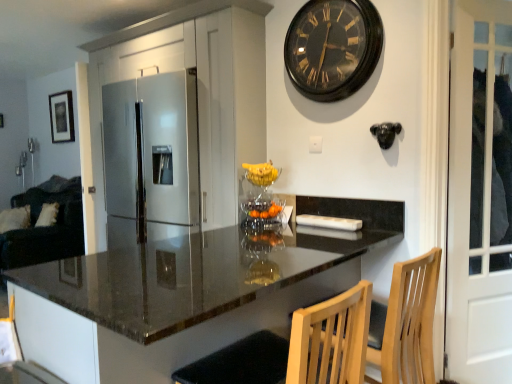
Question: From the image's perspective, is black wooden clock at upper center over black matte picture frame at upper left?

Choices:
 (A) no
 (B) yes

Answer: (A)

Question: Is black matte picture frame at upper left completely or partially inside black wooden clock at upper center?

Choices:
 (A) no
 (B) yes

Answer: (A)

Question: Does black wooden clock at upper center have a greater width compared to black matte picture frame at upper left?

Choices:
 (A) yes
 (B) no

Answer: (A)

Question: Can you confirm if black wooden clock at upper center is shorter than black matte picture frame at upper left?

Choices:
 (A) no
 (B) yes

Answer: (B)

Question: Can you confirm if black wooden clock at upper center is bigger than black matte picture frame at upper left?

Choices:
 (A) no
 (B) yes

Answer: (B)

Question: Does black wooden clock at upper center appear on the right side of black matte picture frame at upper left?

Choices:
 (A) yes
 (B) no

Answer: (A)

Question: Can you confirm if white glass door at right is thinner than polished granite countertop at center?

Choices:
 (A) no
 (B) yes

Answer: (B)

Question: Is white glass door at right to the left of polished granite countertop at center from the viewer's perspective?

Choices:
 (A) yes
 (B) no

Answer: (B)

Question: Is white glass door at right looking in the opposite direction of polished granite countertop at center?

Choices:
 (A) no
 (B) yes

Answer: (A)

Question: Is white glass door at right taller than polished granite countertop at center?

Choices:
 (A) yes
 (B) no

Answer: (A)

Question: From a real-world perspective, is white glass door at right on polished granite countertop at center?

Choices:
 (A) yes
 (B) no

Answer: (A)

Question: Would you say white glass door at right is a long distance from polished granite countertop at center?

Choices:
 (A) no
 (B) yes

Answer: (A)

Question: Is the depth of black wooden clock at upper center less than that of white glass door at right?

Choices:
 (A) yes
 (B) no

Answer: (B)